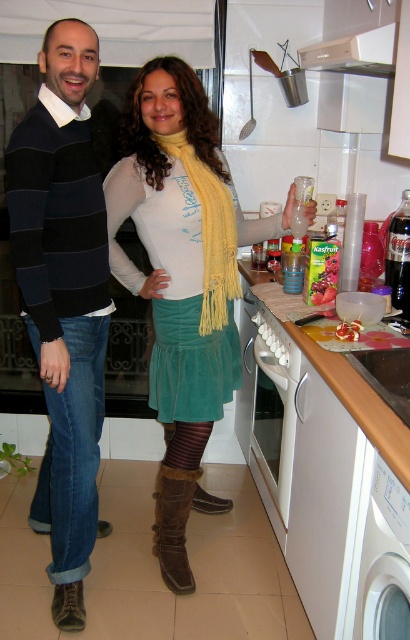
Does suede skirt at center have a smaller size compared to white plastic dishwasher at lower right?

No, suede skirt at center is not smaller than white plastic dishwasher at lower right.

Does suede skirt at center appear on the right side of white plastic dishwasher at lower right?

Incorrect, suede skirt at center is not on the right side of white plastic dishwasher at lower right.

At what (x,y) coordinates should I click in order to perform the action: click on suede skirt at center. Please return your answer as a coordinate pair (x, y). The image size is (410, 640). Looking at the image, I should click on (173, 292).

Identify the location of suede skirt at center. (173, 292).

Is suede skirt at center taller than brown suede boot at lower center?

Correct, suede skirt at center is much taller as brown suede boot at lower center.

Between point (184, 240) and point (163, 509), which one is positioned behind?

The point (163, 509) is behind.

Does point (166, 248) come closer to viewer compared to point (186, 490)?

Yes, point (166, 248) is closer to viewer.

Identify the location of suede skirt at center. Image resolution: width=410 pixels, height=640 pixels. (173, 292).

In the scene shown: Between white glossy oven at center and white matte exhaust hood at upper center, which one appears on the left side from the viewer's perspective?

white glossy oven at center is more to the left.

Find the location of a particular element. white glossy oven at center is located at coordinates (273, 408).

Is point (257, 381) more distant than point (360, 38)?

That is True.

This screenshot has width=410, height=640. What are the coordinates of `white glossy oven at center` in the screenshot? It's located at (273, 408).